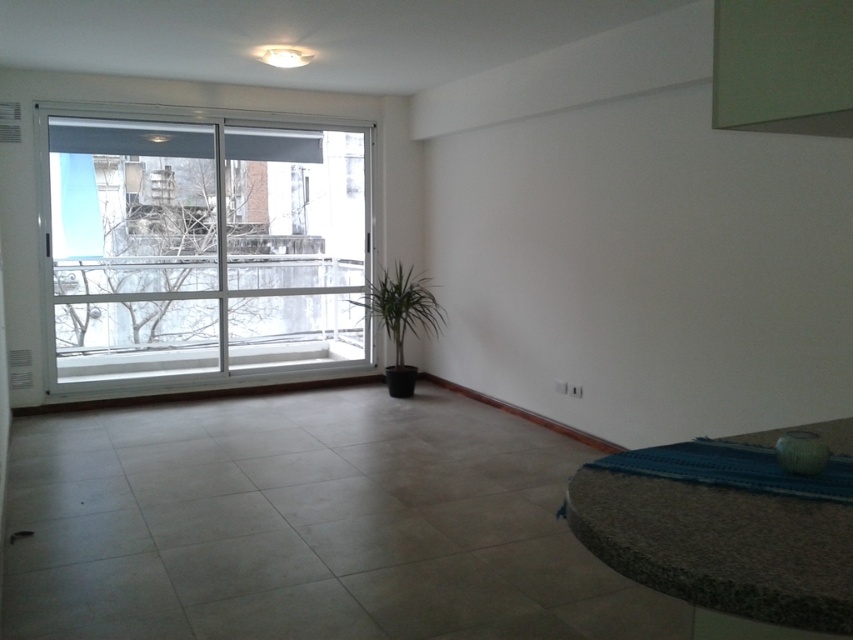
Can you confirm if white plastic window at left is bigger than green matte plant at center?

Yes, white plastic window at left is bigger than green matte plant at center.

Can you confirm if white plastic window at left is positioned to the right of green matte plant at center?

→ No, white plastic window at left is not to the right of green matte plant at center.

The height and width of the screenshot is (640, 853). What do you see at coordinates (204, 246) in the screenshot?
I see `white plastic window at left` at bounding box center [204, 246].

Locate an element on the screen. white plastic window at left is located at coordinates (204, 246).